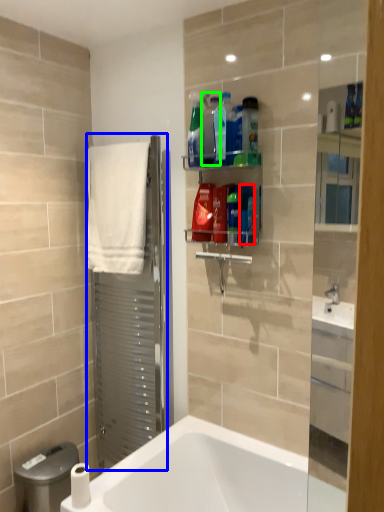
Question: Which object is the closest to the cleaning product (highlighted by a red box)? Choose among these: screen door (highlighted by a blue box) or cleaning product (highlighted by a green box).

Choices:
 (A) screen door
 (B) cleaning product

Answer: (B)